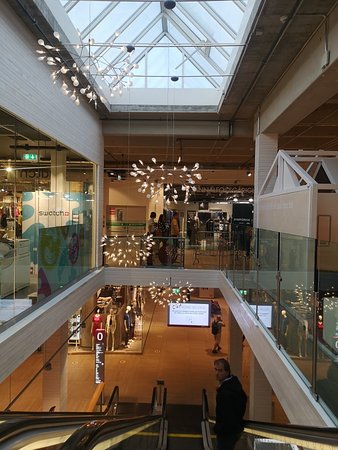
At what (x,y) coordinates should I click in order to perform the action: click on mannequin. Please return your answer as a coordinate pair (x, y). The height and width of the screenshot is (450, 338). Looking at the image, I should click on 112,334.